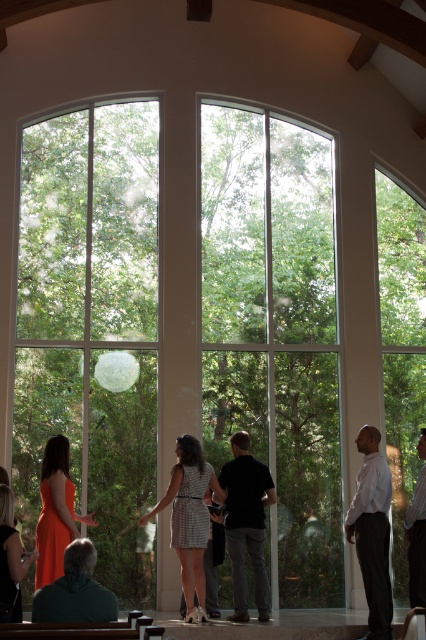
Who is positioned more to the left, clear glass window at right or matte orange dress at lower left?

matte orange dress at lower left

Between point (408, 301) and point (3, 561), which one is positioned behind?

Positioned behind is point (408, 301).

Where is `clear glass window at right`? Image resolution: width=426 pixels, height=640 pixels. clear glass window at right is located at coordinates 402,349.

Between white smooth shirt at right and white matte dress at right, which one appears on the right side from the viewer's perspective?

From the viewer's perspective, white matte dress at right appears more on the right side.

In the scene shown: Does white smooth shirt at right have a greater width compared to white matte dress at right?

Correct, the width of white smooth shirt at right exceeds that of white matte dress at right.

Who is more forward, (388, 502) or (423, 547)?

Point (423, 547) is in front.

I want to click on white smooth shirt at right, so click(x=373, y=531).

Can you confirm if black matte shirt at center is positioned to the right of orange satin dress at lower left?

Yes, black matte shirt at center is to the right of orange satin dress at lower left.

Does black matte shirt at center have a lesser height compared to orange satin dress at lower left?

In fact, black matte shirt at center may be taller than orange satin dress at lower left.

Is point (245, 609) positioned behind point (60, 516)?

Yes.

Image resolution: width=426 pixels, height=640 pixels. What are the coordinates of `black matte shirt at center` in the screenshot? It's located at (247, 524).